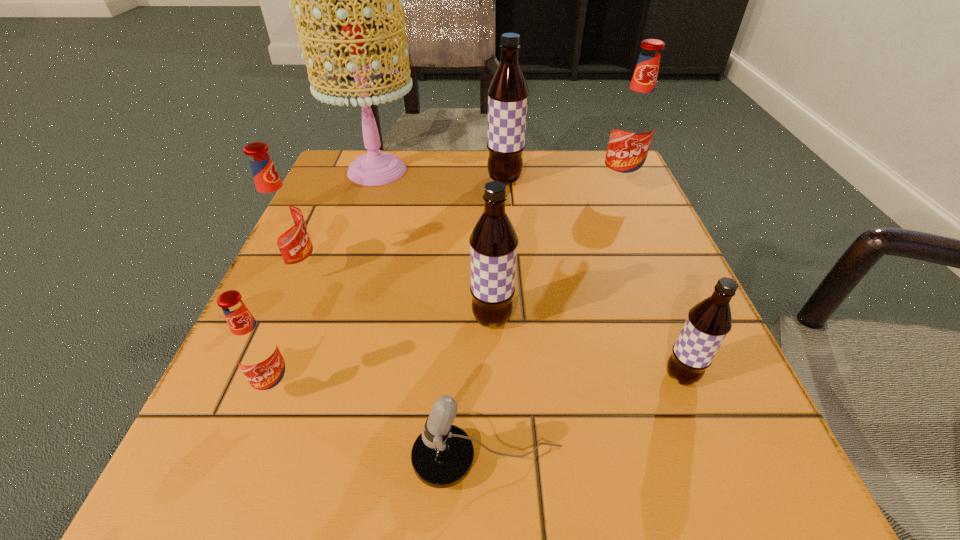
Locate an element on the screen. blank space located on the back of the shortest object is located at coordinates (487, 368).

You are a GUI agent. You are given a task and a screenshot of the screen. Output one action in this format:
    pyautogui.click(x=<x>, y=<y>)
    Task: Click on the lampshade present at the far edge
    This screenshot has width=960, height=540.
    Given the screenshot: What is the action you would take?
    pyautogui.click(x=374, y=168)

Locate an element on the screen. object that is positioned at the near edge is located at coordinates (442, 456).

You are a GUI agent. You are given a task and a screenshot of the screen. Output one action in this format:
    pyautogui.click(x=<x>, y=<y>)
    Task: Click on the lampshade present at the left edge
    The width and height of the screenshot is (960, 540).
    Given the screenshot: What is the action you would take?
    pyautogui.click(x=374, y=168)

The width and height of the screenshot is (960, 540). I want to click on object present at the far left corner, so click(374, 168).

The image size is (960, 540). What are the coordinates of `object situated at the far right corner` in the screenshot? It's located at (633, 125).

You are a GUI agent. You are given a task and a screenshot of the screen. Output one action in this format:
    pyautogui.click(x=<x>, y=<y>)
    Task: Click on the vacant point at the far edge
    The height and width of the screenshot is (540, 960).
    Given the screenshot: What is the action you would take?
    pyautogui.click(x=470, y=160)

Where is `vacant area at the near edge of the desktop`? Image resolution: width=960 pixels, height=540 pixels. vacant area at the near edge of the desktop is located at coordinates (583, 501).

In the image, there is a desktop. Where is `vacant space at the left edge`? vacant space at the left edge is located at coordinates (270, 316).

The image size is (960, 540). I want to click on free space at the right edge of the desktop, so click(600, 289).